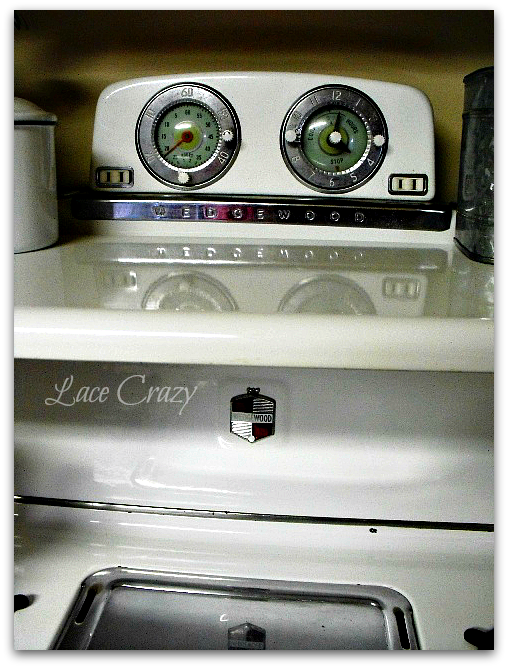
Where is `timer`? The image size is (508, 668). timer is located at coordinates (332, 97), (185, 92).